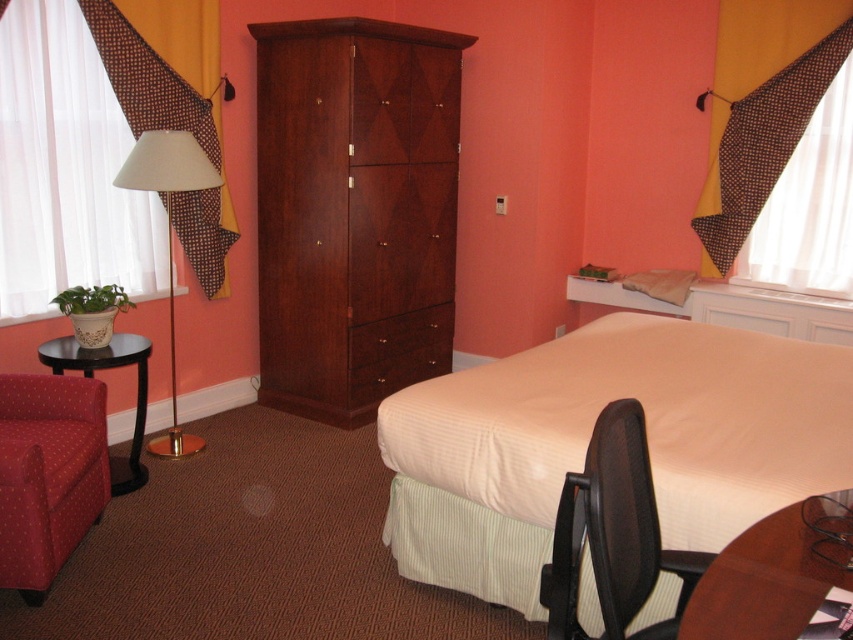
Question: Can you confirm if brown wooden table at lower right is positioned above white fabric lamp at left?

Choices:
 (A) yes
 (B) no

Answer: (B)

Question: Estimate the real-world distances between objects in this image. Which object is farther from the black mesh office chair at lower right?

Choices:
 (A) red fabric swivel chair at lower left
 (B) white fabric lamp at left
 (C) orange fabric curtain at left

Answer: (C)

Question: Among these objects, which one is farthest from the camera?

Choices:
 (A) black mesh office chair at lower right
 (B) white textured bed at center

Answer: (B)

Question: Which point is closer to the camera?

Choices:
 (A) (119, 184)
 (B) (657, 333)
 (C) (802, 4)
 (D) (415, 324)

Answer: (B)

Question: Is white textured bed at center further to the viewer compared to mahogany wood dresser at center?

Choices:
 (A) no
 (B) yes

Answer: (A)

Question: From the image, what is the correct spatial relationship of black mesh office chair at lower right in relation to brown wood drawer at center?

Choices:
 (A) above
 (B) below

Answer: (B)